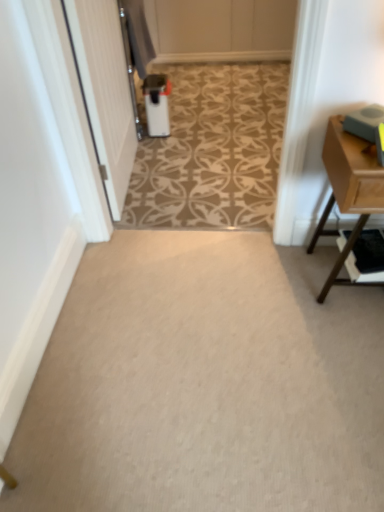
Question: From a real-world perspective, is light brown wood table at right beneath carpet at center?

Choices:
 (A) no
 (B) yes

Answer: (A)

Question: Is light brown wood table at right with carpet at center?

Choices:
 (A) no
 (B) yes

Answer: (A)

Question: From the image's perspective, is light brown wood table at right below carpet at center?

Choices:
 (A) no
 (B) yes

Answer: (B)

Question: From a real-world perspective, is light brown wood table at right located higher than carpet at center?

Choices:
 (A) yes
 (B) no

Answer: (A)

Question: Could you tell me if light brown wood table at right is turned towards carpet at center?

Choices:
 (A) yes
 (B) no

Answer: (B)

Question: Can you confirm if light brown wood table at right is positioned to the left of carpet at center?

Choices:
 (A) no
 (B) yes

Answer: (A)

Question: From a real-world perspective, does light brown wood table at right stand above wooden shelf at right?

Choices:
 (A) no
 (B) yes

Answer: (B)

Question: From the image's perspective, is light brown wood table at right located above wooden shelf at right?

Choices:
 (A) no
 (B) yes

Answer: (B)

Question: Is light brown wood table at right smaller than wooden shelf at right?

Choices:
 (A) yes
 (B) no

Answer: (B)

Question: Is there a large distance between light brown wood table at right and wooden shelf at right?

Choices:
 (A) no
 (B) yes

Answer: (A)

Question: Is light brown wood table at right outside of wooden shelf at right?

Choices:
 (A) yes
 (B) no

Answer: (A)

Question: Is light brown wood table at right thinner than wooden shelf at right?

Choices:
 (A) yes
 (B) no

Answer: (B)

Question: From a real-world perspective, is light brown wood table at right over white glossy trash can at center?

Choices:
 (A) no
 (B) yes

Answer: (B)